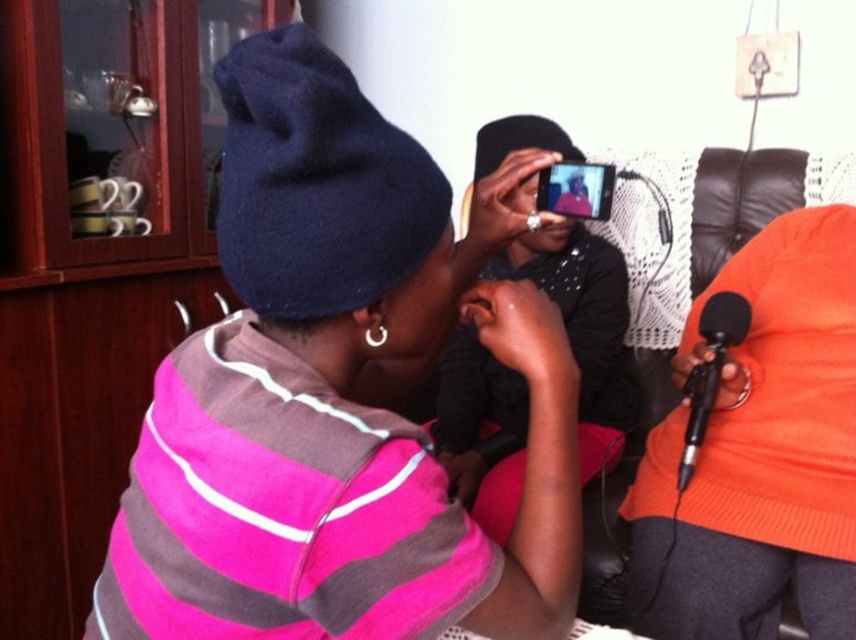
Question: Does matte black beanie at upper left appear over orange knitted sweater at right?

Choices:
 (A) yes
 (B) no

Answer: (A)

Question: Which point is farther to the camera?

Choices:
 (A) (758, 301)
 (B) (693, 467)
 (C) (270, 234)

Answer: (A)

Question: Estimate the real-world distances between objects in this image. Which object is farther from the matte black beanie at upper left?

Choices:
 (A) orange knitted sweater at right
 (B) black metallic microphone at lower right

Answer: (A)

Question: Is matte black beanie at upper left closer to the viewer compared to orange knitted sweater at right?

Choices:
 (A) no
 (B) yes

Answer: (B)

Question: Is orange knitted sweater at right further to camera compared to black metallic microphone at lower right?

Choices:
 (A) no
 (B) yes

Answer: (A)

Question: Which point appears farthest from the camera in this image?

Choices:
 (A) (708, 392)
 (B) (449, 209)

Answer: (A)